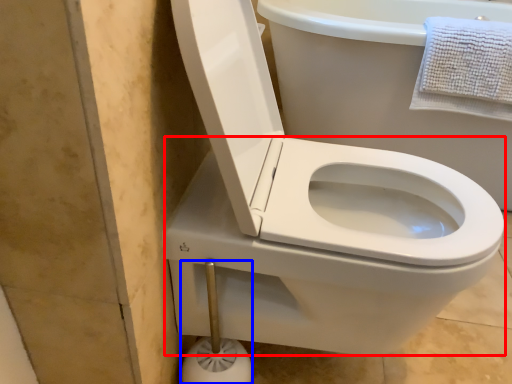
Question: Which of the following is the closest to the observer, bidet (highlighted by a red box) or towel bar (highlighted by a blue box)?

Choices:
 (A) bidet
 (B) towel bar

Answer: (A)